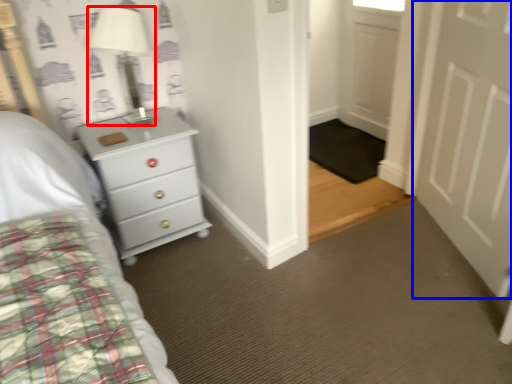
Question: Which of the following is the closest to the observer, lamp (highlighted by a red box) or door (highlighted by a blue box)?

Choices:
 (A) lamp
 (B) door

Answer: (B)